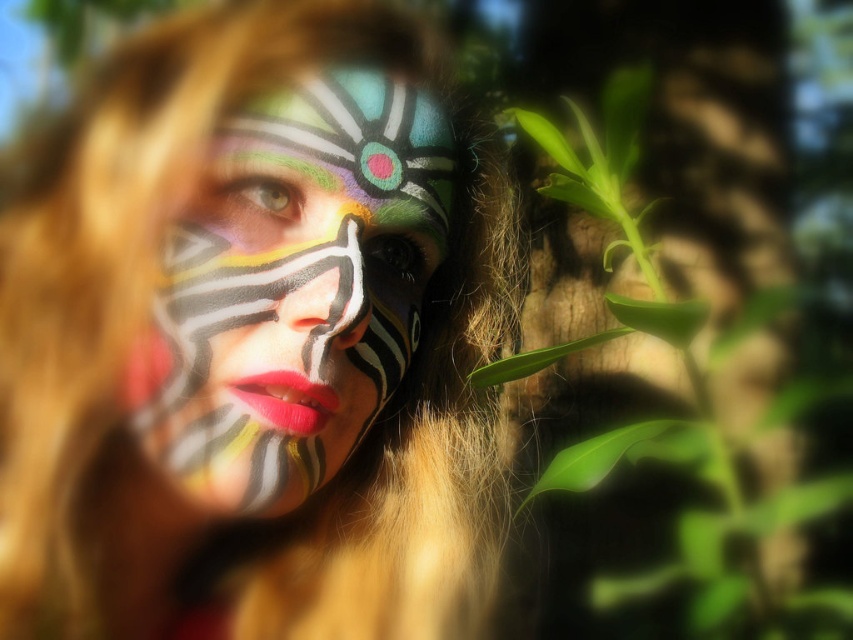
Who is higher up, matte paint face at center or matte painted face at center?

matte painted face at center

Describe the element at coordinates (254, 339) in the screenshot. I see `matte paint face at center` at that location.

This screenshot has width=853, height=640. Find the location of `matte paint face at center`. matte paint face at center is located at coordinates (254, 339).

Where is `matte paint face at center`? The width and height of the screenshot is (853, 640). matte paint face at center is located at coordinates [254, 339].